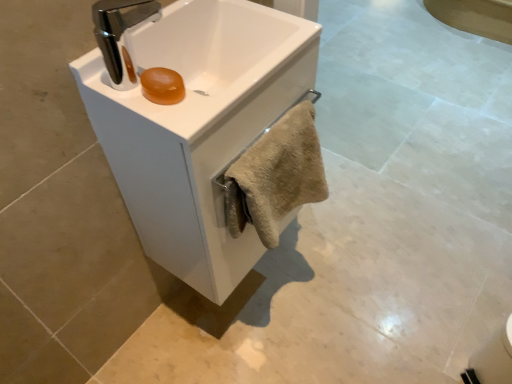
Question: Is white glossy sink at center, the 2th sink positioned from the back, in front of or behind beige fuzzy towel at center in the image?

Choices:
 (A) front
 (B) behind

Answer: (A)

Question: From a real-world perspective, is white glossy sink at center, the first sink viewed from the front, positioned above or below beige fuzzy towel at center?

Choices:
 (A) above
 (B) below

Answer: (A)

Question: Which object is positioned closest to the white glossy sink at center, marked as the 1th sink in a back-to-front arrangement?

Choices:
 (A) beige fuzzy towel at center
 (B) white glossy sink at center, the 2th sink positioned from the back

Answer: (B)

Question: Which object is positioned farthest from the white glossy sink at center, the first sink viewed from the front?

Choices:
 (A) white glossy sink at center, arranged as the second sink when viewed from the front
 (B) beige fuzzy towel at center

Answer: (B)